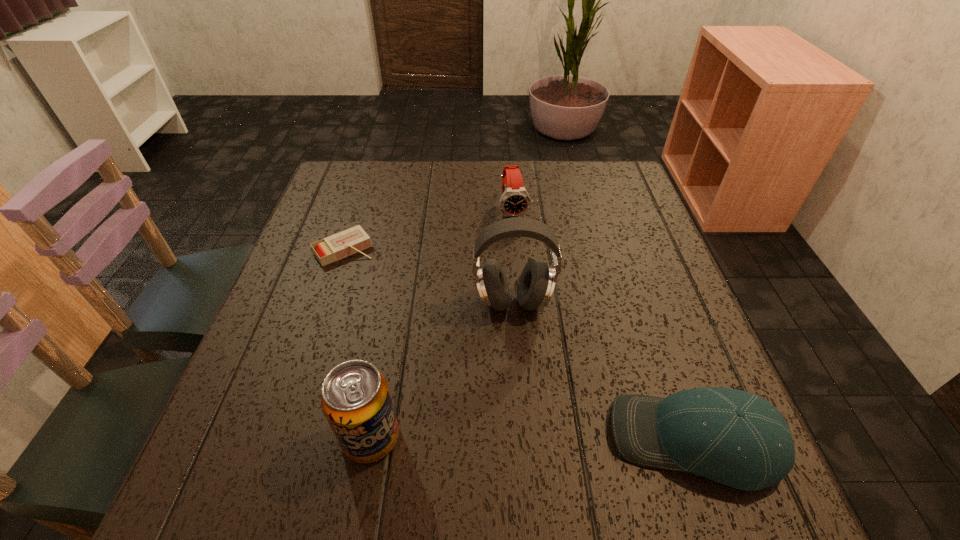
This screenshot has height=540, width=960. What are the coordinates of `free spot located on the right of the second tallest object` in the screenshot? It's located at (466, 437).

In order to click on vacant space positioned 0.190m on the left of the rightmost object in this screenshot , I will do `click(497, 441)`.

At what (x,y) coordinates should I click in order to perform the action: click on free spot located on the striking surface of the leftmost object. Please return your answer as a coordinate pair (x, y). This screenshot has width=960, height=540. Looking at the image, I should click on (412, 335).

You are a GUI agent. You are given a task and a screenshot of the screen. Output one action in this format:
    pyautogui.click(x=<x>, y=<y>)
    Task: Click on the free spot located 0.380m on the striking surface of the leftmost object
    This screenshot has width=960, height=540.
    Given the screenshot: What is the action you would take?
    pyautogui.click(x=444, y=377)

The image size is (960, 540). Identify the location of free spot located on the striking surface of the leftmost object. (438, 369).

Find the location of a particular element. The image size is (960, 540). vacant space situated on the face of the watch is located at coordinates (529, 275).

I want to click on free space located 0.280m on the face of the watch, so pyautogui.click(x=538, y=307).

Image resolution: width=960 pixels, height=540 pixels. What are the coordinates of `vacant area situated 0.080m on the face of the watch` in the screenshot? It's located at (522, 246).

The image size is (960, 540). What are the coordinates of `vacant space located 0.080m on the ear cups of the third nearest object` in the screenshot? It's located at (x=511, y=354).

I want to click on vacant area situated 0.210m on the ear cups of the third nearest object, so click(x=509, y=415).